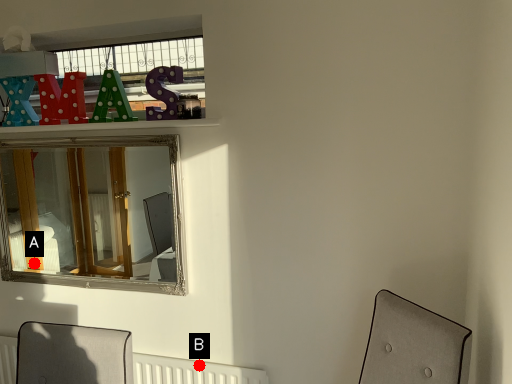
Question: Two points are circled on the image, labeled by A and B beside each circle. Which point is closer to the camera?

Choices:
 (A) A is closer
 (B) B is closer

Answer: (B)